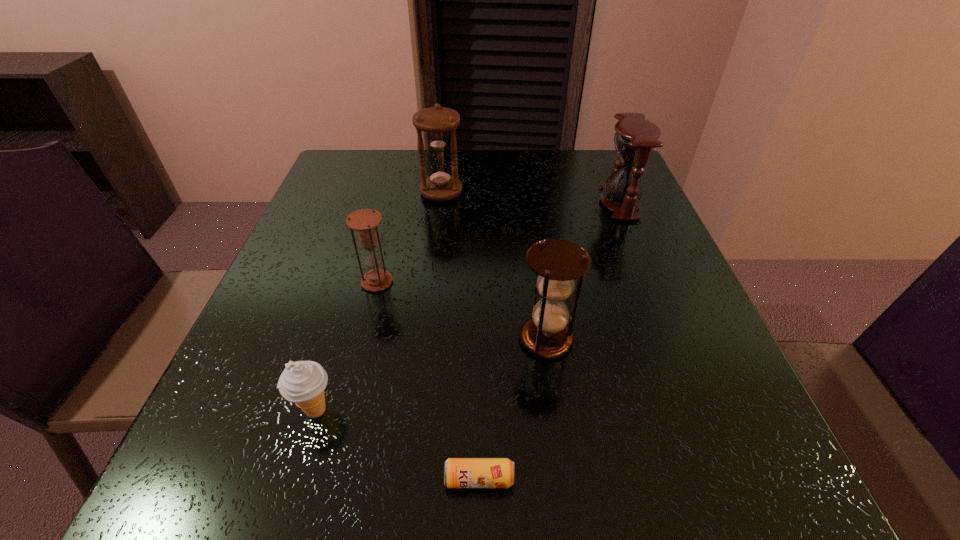
The image size is (960, 540). I want to click on free space located on the right of the second hourglass from left to right, so click(x=483, y=192).

This screenshot has width=960, height=540. I want to click on vacant space located 0.190m on the front of the rightmost hourglass, so click(652, 281).

You are a GUI agent. You are given a task and a screenshot of the screen. Output one action in this format:
    pyautogui.click(x=<x>, y=<y>)
    Task: Click on the vacant region located on the left of the nearest hourglass
    The height and width of the screenshot is (540, 960).
    Given the screenshot: What is the action you would take?
    pyautogui.click(x=412, y=339)

The height and width of the screenshot is (540, 960). Find the location of `vacant space located 0.380m on the front of the second nearest hourglass`. vacant space located 0.380m on the front of the second nearest hourglass is located at coordinates [321, 511].

Locate an element on the screen. This screenshot has height=540, width=960. vacant space located on the back of the second shortest object is located at coordinates (339, 335).

Where is `blank space located on the left of the shortest object`? The width and height of the screenshot is (960, 540). blank space located on the left of the shortest object is located at coordinates (300, 479).

You are a GUI agent. You are given a task and a screenshot of the screen. Output one action in this format:
    pyautogui.click(x=<x>, y=<y>)
    Task: Click on the object at the near edge
    
    Given the screenshot: What is the action you would take?
    pyautogui.click(x=458, y=472)

What are the coordinates of `object at the left edge` in the screenshot? It's located at (302, 382).

At what (x,y) coordinates should I click in order to perform the action: click on object located in the right edge section of the desktop. Please return your answer as a coordinate pair (x, y). The width and height of the screenshot is (960, 540). Looking at the image, I should click on (635, 138).

Locate an element on the screen. The image size is (960, 540). object that is at the far right corner is located at coordinates (635, 138).